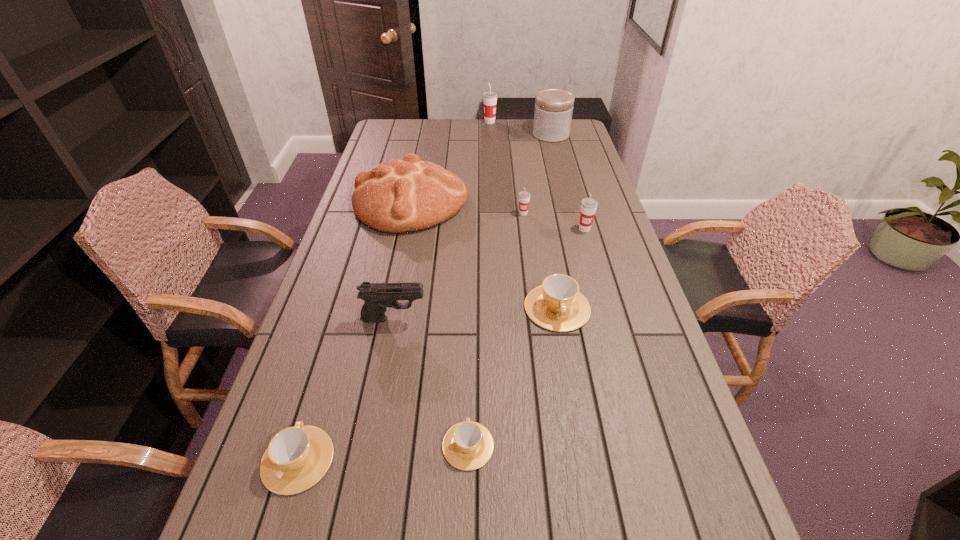
Find the location of `the farthest cup`. the farthest cup is located at coordinates (490, 97).

Locate an element on the screen. This screenshot has width=960, height=540. the leftmost red cup is located at coordinates (490, 97).

Find the location of `the eighth nearest object`. the eighth nearest object is located at coordinates (553, 111).

Find the location of a particular element. bread is located at coordinates (397, 196).

This screenshot has width=960, height=540. I want to click on the second biggest red cup, so click(x=588, y=205).

Identify the location of the nearest red cup. This screenshot has width=960, height=540. (588, 205).

The image size is (960, 540). Find the location of `pistol`. pistol is located at coordinates (377, 296).

Locate an element on the screen. the fifth nearest cup is located at coordinates (524, 196).

I want to click on the smallest red cup, so click(x=524, y=196).

What are the coordinates of `the rightmost brown cup` in the screenshot? It's located at (557, 305).